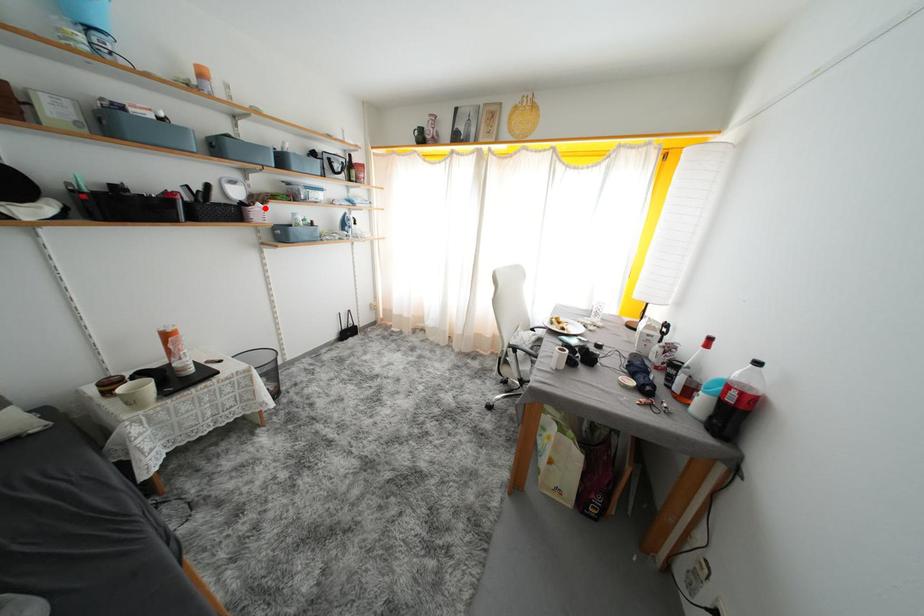
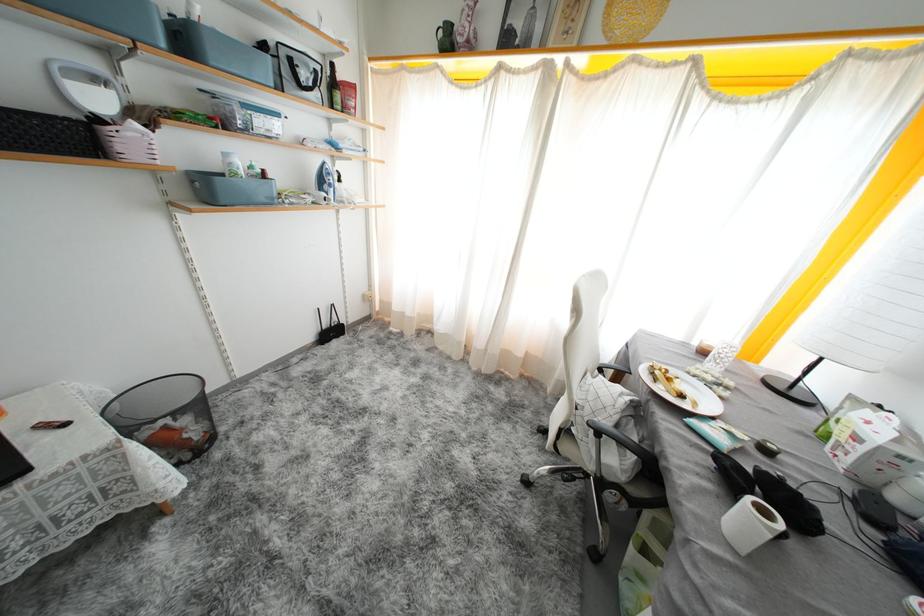
Find the pixel in the second image that matches the highlighted location in the first image.

(141, 129)